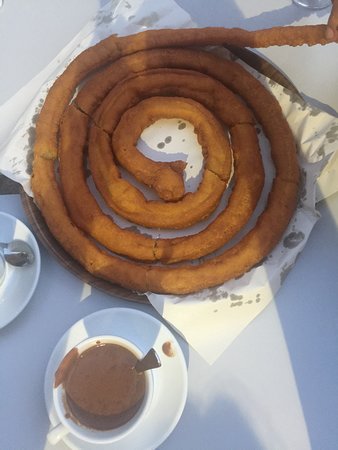
Find the location of a particular element. table is located at coordinates (274, 425).